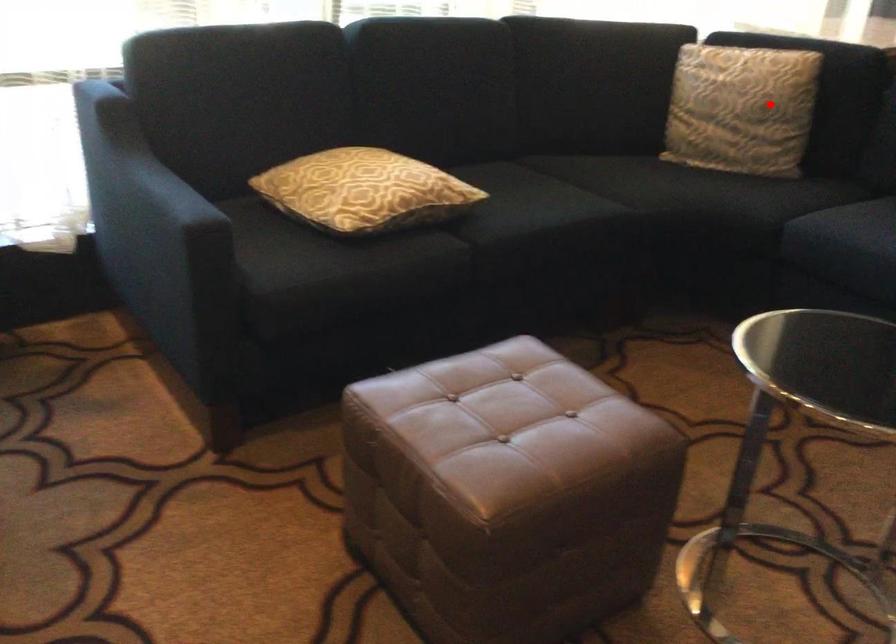
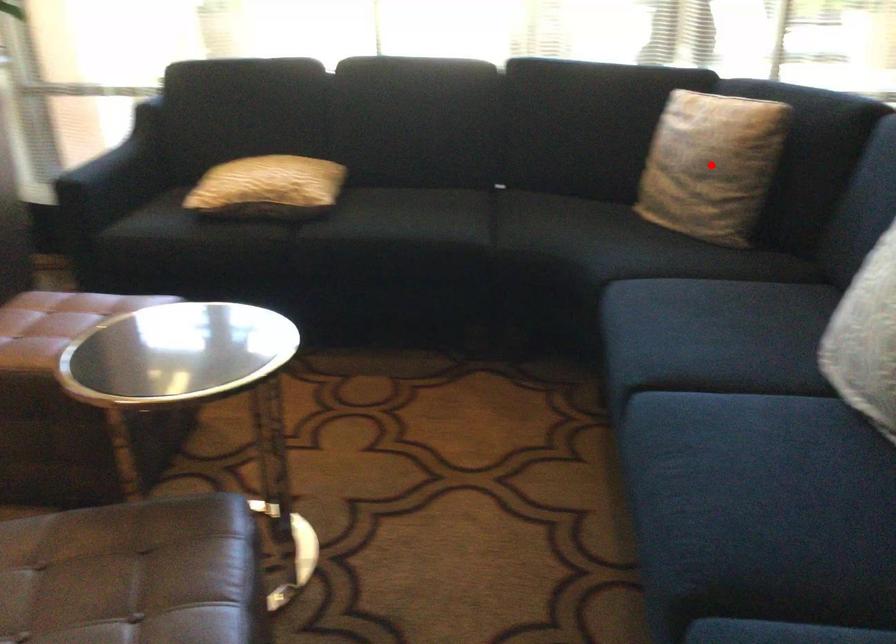
I am providing you with two images of the same scene from different viewpoints. A red point is marked on the first image and another point is marked on the second image. Do the highlighted points in image1 and image2 indicate the same real-world spot?

Yes